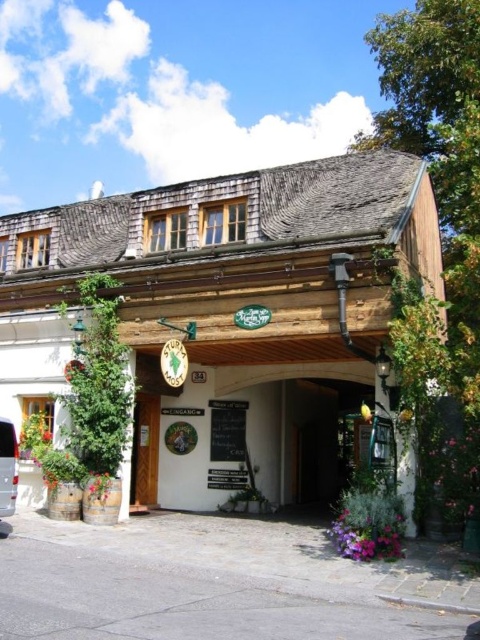
Does white wood building at center have a larger size compared to silver metallic van at lower left?

Correct, white wood building at center is larger in size than silver metallic van at lower left.

Consider the image. Can you confirm if white wood building at center is positioned above silver metallic van at lower left?

Yes.

Is point (367, 268) in front of point (15, 474)?

No, (367, 268) is behind (15, 474).

Locate an element on the screen. This screenshot has height=640, width=480. white wood building at center is located at coordinates (229, 308).

Who is taller, white wood building at center or wooden door at center?

white wood building at center is taller.

The height and width of the screenshot is (640, 480). Find the location of `white wood building at center`. white wood building at center is located at coordinates (229, 308).

Is point (158, 412) positioned after point (8, 445)?

That is True.

Who is lower down, wooden door at center or silver metallic van at lower left?

wooden door at center is lower down.

Is point (141, 444) closer to viewer compared to point (8, 484)?

No.

Locate an element on the screen. wooden door at center is located at coordinates (144, 451).